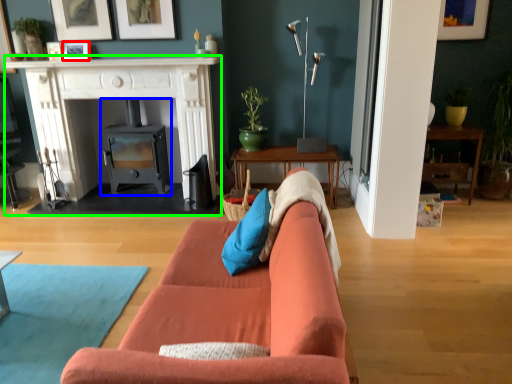
Question: Considering the real-world distances, which object is closest to picture frame (highlighted by a red box)? wood burning stove (highlighted by a blue box) or fireplace (highlighted by a green box).

Choices:
 (A) wood burning stove
 (B) fireplace

Answer: (B)